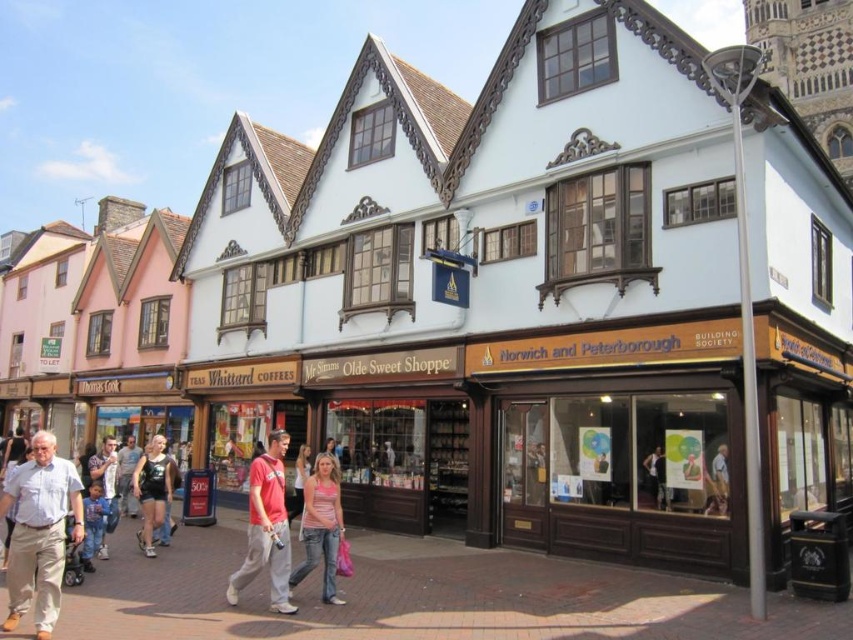
You are a customer entering the historic shopping area and notice two items of clothing. The light blue cotton shirt at lower left and the matte black shorts at center. Which clothing item is positioned more to the left?

The matte black shorts at center are positioned more to the left because the light blue cotton shirt at lower left is to the right of the matte black shorts at center.